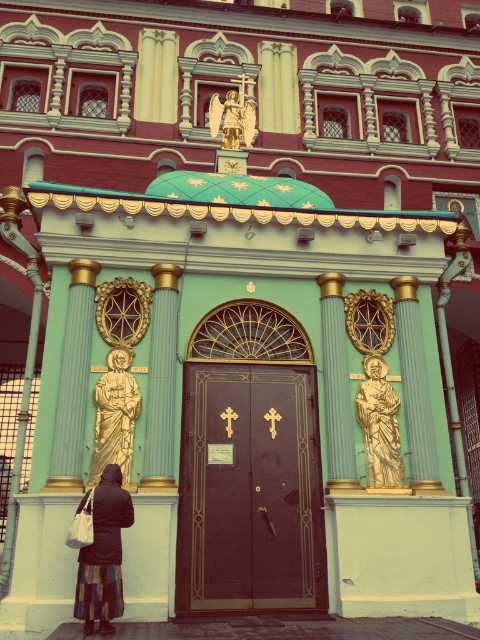
You are standing at the entrance of the grand building and want to take a photo. There are two points marked on the facade at coordinates point (402, 470) and point (252, 132). Which point will appear larger in your photo?

Point (402, 470) is closer to the camera than point (252, 132), so it will appear larger in the photo.